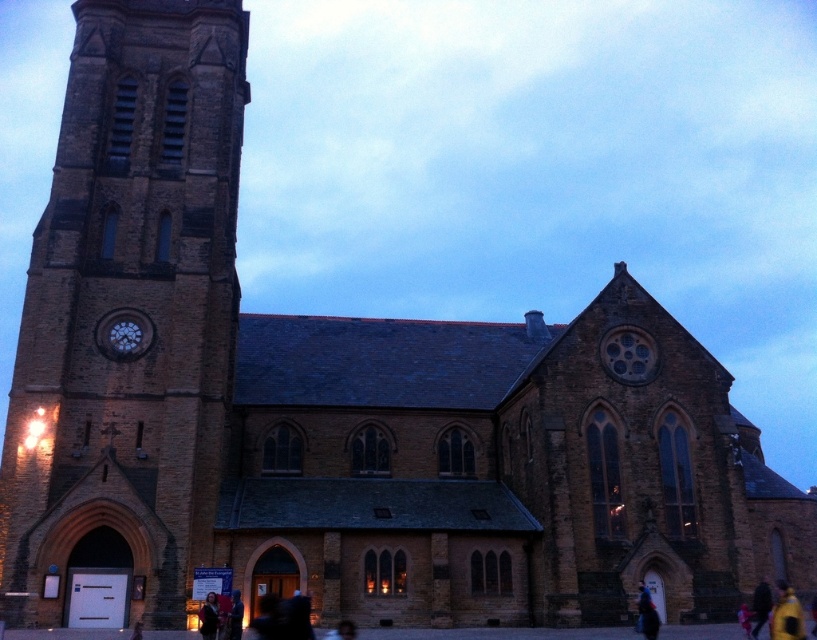
You are a visitor standing at the entrance of the historic church. You notice a matte stone clock at upper left and a dark brown leather jacket at center. Which object is bigger in size?

The matte stone clock at upper left is larger in size than the dark brown leather jacket at center.

You are standing at the entrance of the church and see a yellow fabric bag at lower right and a dark brown leather jacket at lower left. Which item is positioned closer to your right side?

The yellow fabric bag at lower right is positioned closer to your right side because it is to the right of the dark brown leather jacket at lower left.

You are standing inside the historic church and want to take a photo of both point (124, 328) and point (237, 605). Based on their positions, which point should you focus on first to ensure both are in clear view?

You should focus on point (124, 328) first because it is closer to the camera than point (237, 605). This ensures both points are in focus as the depth of field will likely cover the distance between them.